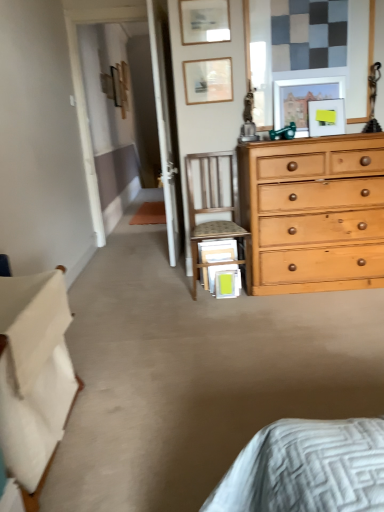
Question: Is yellow matte picture frame at upper center, acting as the fourth picture frame starting from the back, inside matte wooden picture frame at upper right, marked as the second picture frame in a bottom-to-top arrangement?

Choices:
 (A) no
 (B) yes

Answer: (B)

Question: Is matte wooden picture frame at upper right, which is the third picture frame from back to front, next to yellow matte picture frame at upper center, the fifth picture frame from the left, and touching it?

Choices:
 (A) yes
 (B) no

Answer: (B)

Question: From the image's perspective, is matte wooden picture frame at upper right, marked as the second picture frame in a bottom-to-top arrangement, on yellow matte picture frame at upper center, positioned as the 1th picture frame in right-to-left order?

Choices:
 (A) no
 (B) yes

Answer: (B)

Question: Does matte wooden picture frame at upper right, acting as the fourth picture frame starting from the top, have a larger size compared to yellow matte picture frame at upper center, which is counted as the 5th picture frame, starting from the top?

Choices:
 (A) no
 (B) yes

Answer: (B)

Question: Could you tell me if matte wooden picture frame at upper right, which is the third picture frame from back to front, is facing yellow matte picture frame at upper center, arranged as the 1th picture frame when ordered from the bottom?

Choices:
 (A) no
 (B) yes

Answer: (B)

Question: From a real-world perspective, is matte wooden picture frame at upper right, marked as the second picture frame in a bottom-to-top arrangement, positioned over yellow matte picture frame at upper center, acting as the fourth picture frame starting from the back, based on gravity?

Choices:
 (A) yes
 (B) no

Answer: (A)

Question: Is matte wooden picture frame at upper center, the second picture frame in the left-to-right sequence, outside of wooden picture frame at upper center, arranged as the fifth picture frame when viewed from the right?

Choices:
 (A) yes
 (B) no

Answer: (A)

Question: From a real-world perspective, does matte wooden picture frame at upper center, the fifth picture frame positioned from the back, sit lower than wooden picture frame at upper center, arranged as the fifth picture frame when viewed from the right?

Choices:
 (A) yes
 (B) no

Answer: (B)

Question: Does matte wooden picture frame at upper center, which is the 4th picture frame in right-to-left order, appear on the left side of wooden picture frame at upper center, arranged as the fifth picture frame when viewed from the right?

Choices:
 (A) yes
 (B) no

Answer: (B)

Question: Does matte wooden picture frame at upper center, marked as the 4th picture frame in a bottom-to-top arrangement, appear on the right side of wooden picture frame at upper center, which is counted as the first picture frame, starting from the back?

Choices:
 (A) yes
 (B) no

Answer: (A)

Question: Is matte wooden picture frame at upper center, acting as the first picture frame starting from the front, not close to wooden picture frame at upper center, which is counted as the first picture frame, starting from the back?

Choices:
 (A) yes
 (B) no

Answer: (A)

Question: Can you confirm if matte wooden picture frame at upper center, which is the 4th picture frame in right-to-left order, is thinner than wooden picture frame at upper center, arranged as the fifth picture frame when viewed from the right?

Choices:
 (A) yes
 (B) no

Answer: (A)

Question: Does yellow matte picture frame at upper center, positioned as the 1th picture frame in right-to-left order, have a greater width compared to wooden picture frame at upper center, which is the 3th picture frame from left to right?

Choices:
 (A) no
 (B) yes

Answer: (B)